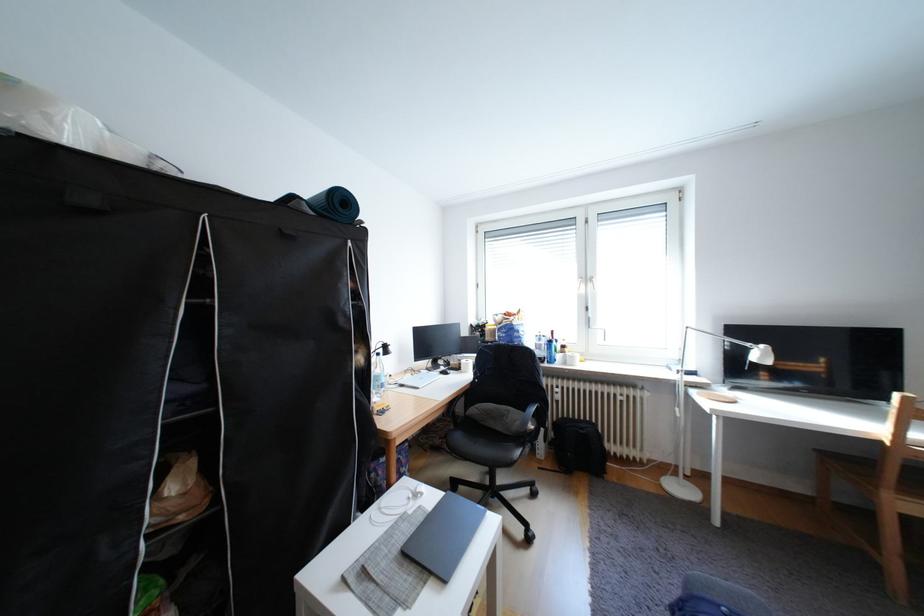
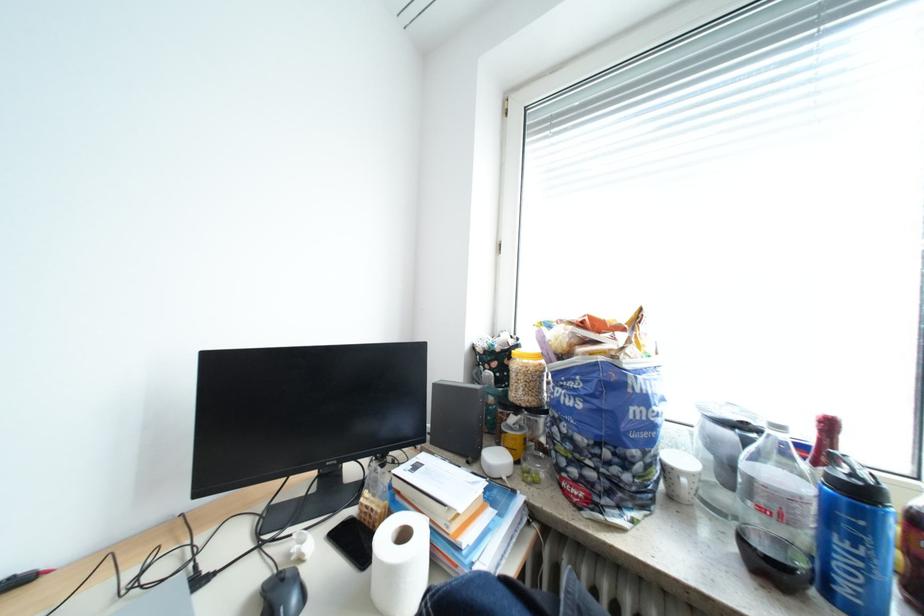
Question: Which direction would the cameraman need to move to produce the second image? Reply with the corresponding letter.

Choices:
 (A) Left
 (B) Right
 (C) Forward
 (D) Backward

Answer: (C)